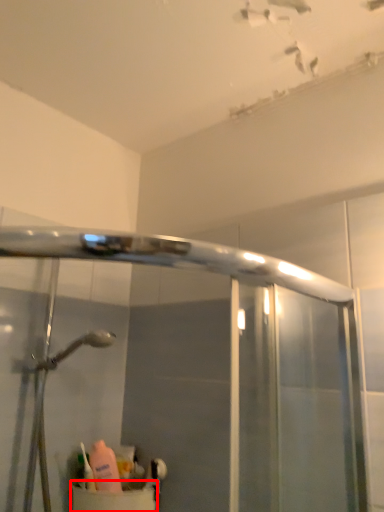
Question: From the image's perspective, where is sink (annotated by the red box) located in relation to toiletry in the image?

Choices:
 (A) above
 (B) below

Answer: (B)